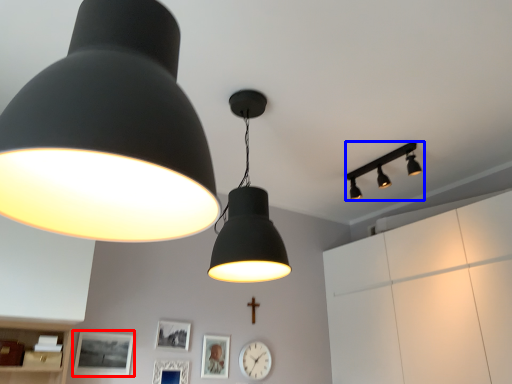
Question: Which object is closer to the camera taking this photo, picture frame (highlighted by a red box) or lamp (highlighted by a blue box)?

Choices:
 (A) picture frame
 (B) lamp

Answer: (A)